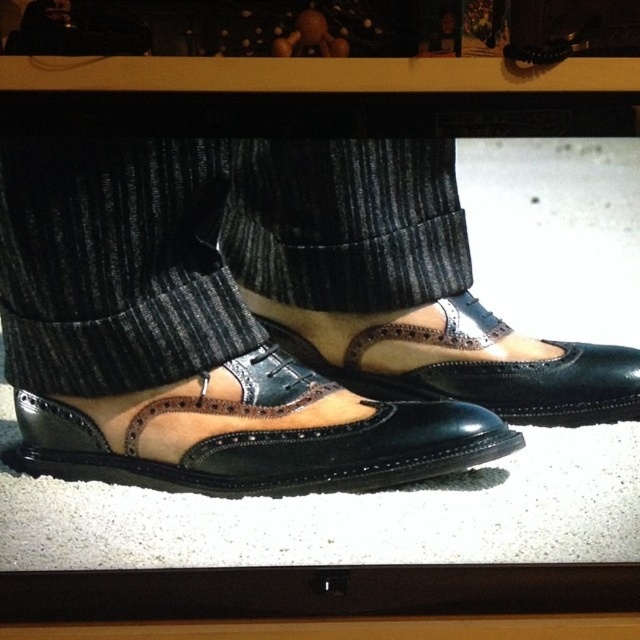
Question: Can you confirm if suede leather shoes at center is smaller than suede/leather wingtip shoe at center?

Choices:
 (A) no
 (B) yes

Answer: (A)

Question: Does suede leather shoes at center have a smaller size compared to suede/black shoe at center?

Choices:
 (A) no
 (B) yes

Answer: (A)

Question: Does suede/black shoe at center appear on the left side of suede/leather wingtip shoe at center?

Choices:
 (A) yes
 (B) no

Answer: (A)

Question: Which of these objects is positioned farthest from the suede leather shoes at center?

Choices:
 (A) suede/leather wingtip shoe at center
 (B) suede/black shoe at center

Answer: (A)

Question: Which point is closer to the camera?

Choices:
 (A) (403, 458)
 (B) (557, 358)
 (C) (65, 211)

Answer: (C)

Question: Which of these objects is positioned farthest from the suede leather shoes at center?

Choices:
 (A) suede/leather wingtip shoe at center
 (B) suede/black shoe at center

Answer: (A)